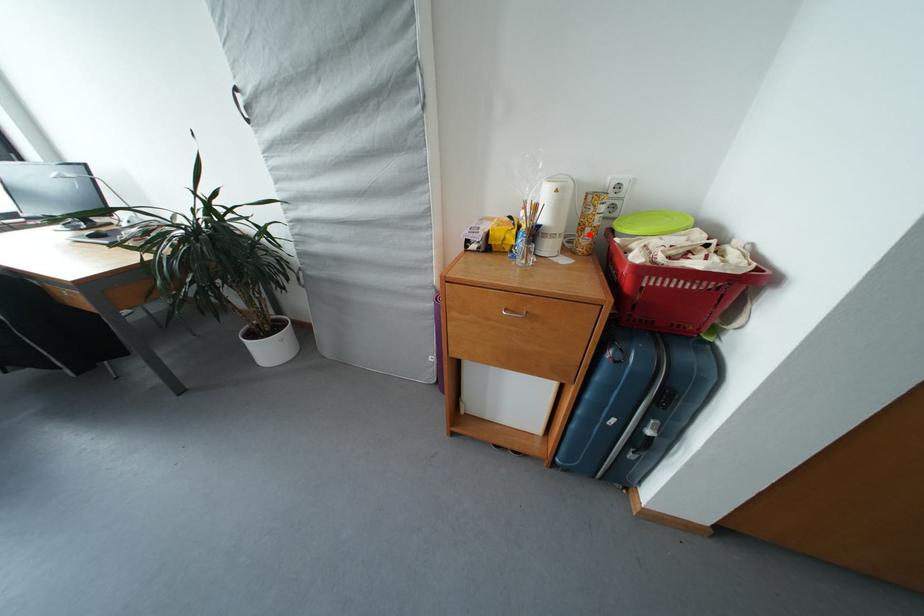
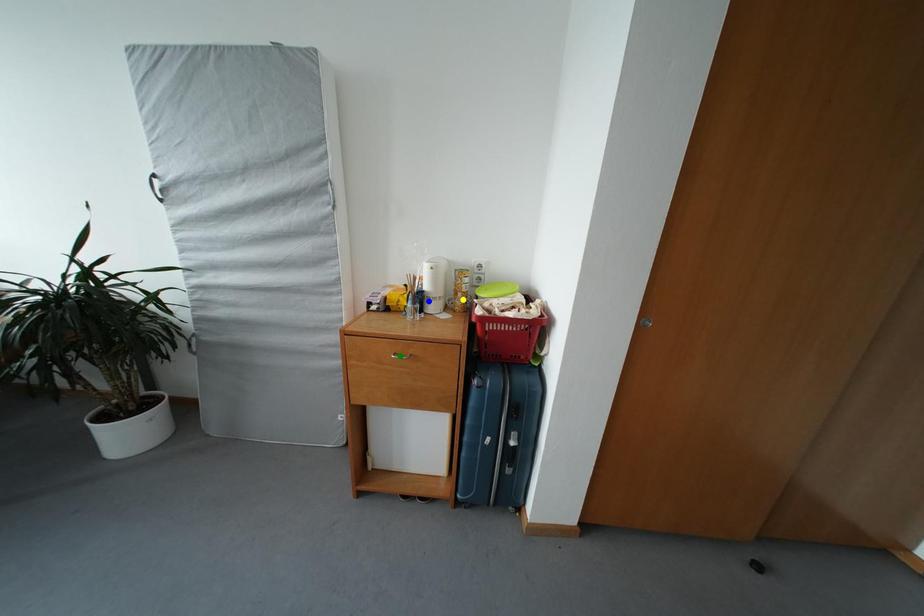
Question: I am providing you with two images of the same scene from different viewpoints. A red point is marked on the first image. You are given multiple points on the second image. Can you choose the point in image 2 that corresponds to the point in image 1?

Choices:
 (A) green point
 (B) yellow point
 (C) blue point

Answer: (B)